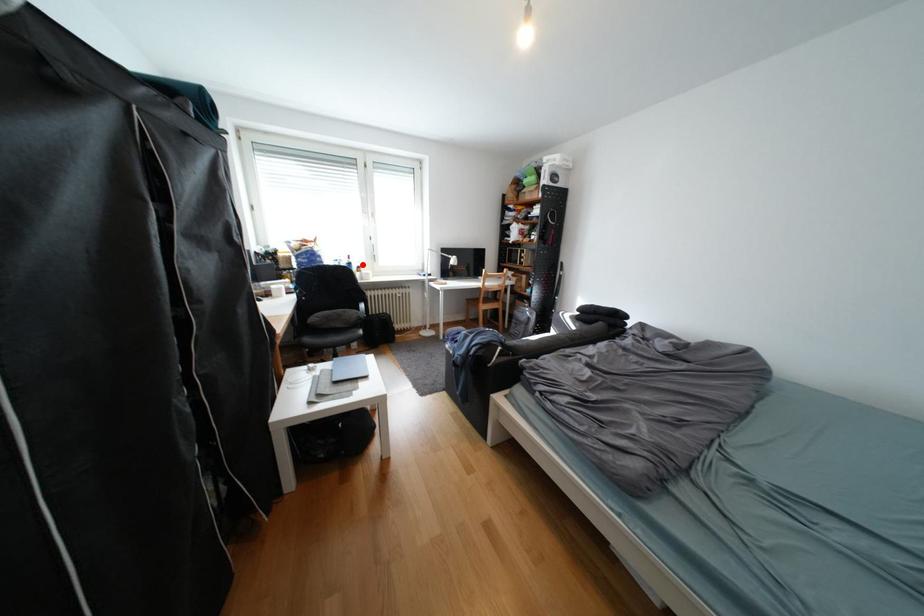
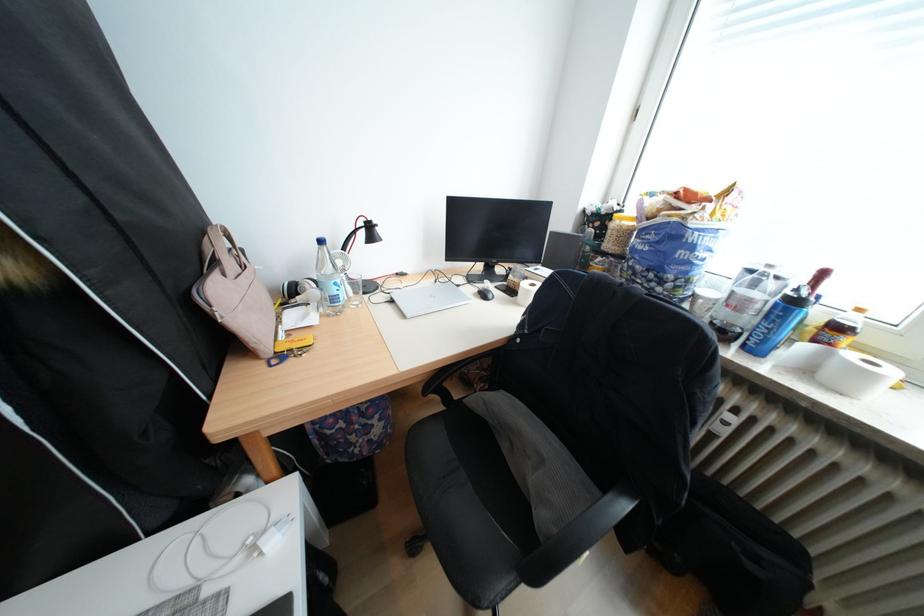
Question: I am providing you with two images of the same scene from different viewpoints. A red point is shown in image1. For the corresponding object point in image2, is it positioned nearer or farther from the camera?

Choices:
 (A) Nearer
 (B) Farther

Answer: (B)